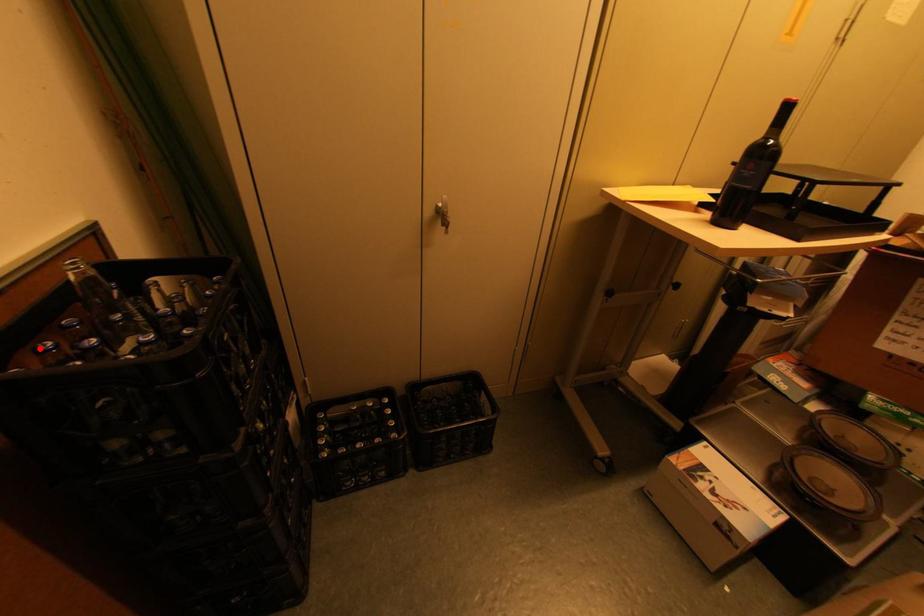
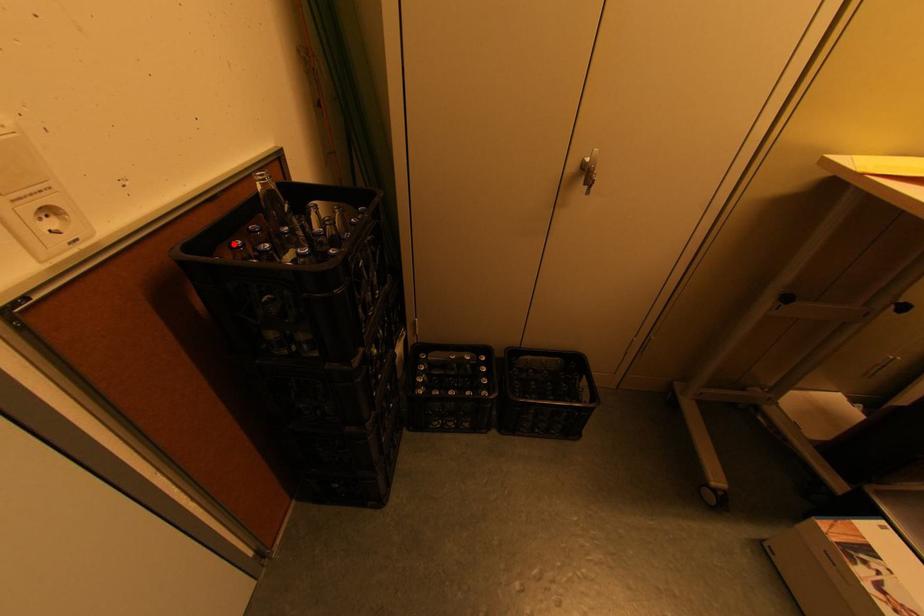
I am providing you with two images of the same scene from different viewpoints. A red point is marked on the first image and another point is marked on the second image. Is the marked point in image1 the same physical position as the marked point in image2?

Yes